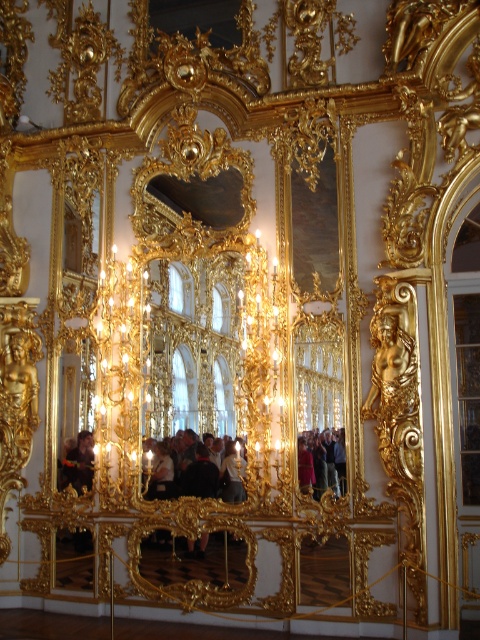
You are standing in the center of the room and want to look up at the shiny gold chandelier at center. What are the coordinates where you should direct your gaze?

You should direct your gaze to the coordinates point at (x=120, y=337) to look at the shiny gold chandelier at center.

You are a guest at a party in this room and want to hang your dark brown leather jacket at center on a hook near the shiny gold chandelier at center. Can you reach the hook if the jacket is as tall as the jacket described?

The shiny gold chandelier at center is shorter than the dark brown leather jacket at center, so the jacket is taller. Since the hook is near the chandelier, which is shorter, the jacket might be too tall to hang comfortably unless the hook is placed higher.

You are standing in the opulent interior space and want to move from the point at coordinates point (108, 339) to the point at coordinates point (345, 460). Which direction should you move in to reach your destination?

Since point (108, 339) is behind point (345, 460), you should move forward to reach the destination.